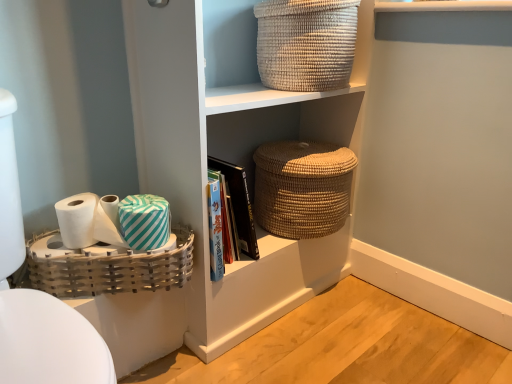
Question: Is natural woven basket at center, positioned as the 2th basket in bottom-to-top order, not inside white matte toilet paper at lower left, the 1th toilet paper positioned from the left?

Choices:
 (A) yes
 (B) no

Answer: (A)

Question: Can you confirm if natural woven basket at center, the 2th basket viewed from the top, is wider than white matte toilet paper at lower left, the 1th toilet paper positioned from the left?

Choices:
 (A) yes
 (B) no

Answer: (A)

Question: Is natural woven basket at center, the 2th basket viewed from the top, positioned with its back to white matte toilet paper at lower left, the 1th toilet paper positioned from the left?

Choices:
 (A) yes
 (B) no

Answer: (B)

Question: From a real-world perspective, is natural woven basket at center, positioned as the 2th basket in bottom-to-top order, beneath white matte toilet paper at lower left, placed as the 2th toilet paper when sorted from right to left?

Choices:
 (A) yes
 (B) no

Answer: (A)

Question: Does natural woven basket at center, positioned as the 2th basket in bottom-to-top order, have a lesser width compared to white matte toilet paper at lower left, the 1th toilet paper positioned from the left?

Choices:
 (A) no
 (B) yes

Answer: (A)

Question: Would you say woven bamboo basket at lower left, which is counted as the 3th basket, starting from the top, is to the left or to the right of teal striped fabric at lower left in the picture?

Choices:
 (A) right
 (B) left

Answer: (B)

Question: From the image's perspective, is woven bamboo basket at lower left, which is the 1th basket from bottom to top, located above or below teal striped fabric at lower left?

Choices:
 (A) below
 (B) above

Answer: (A)

Question: Considering the positions of woven bamboo basket at lower left, which is the 1th basket from bottom to top, and teal striped fabric at lower left in the image, is woven bamboo basket at lower left, which is the 1th basket from bottom to top, taller or shorter than teal striped fabric at lower left?

Choices:
 (A) tall
 (B) short

Answer: (A)

Question: From a real-world perspective, is woven bamboo basket at lower left, which is the 1th basket from bottom to top, physically located above or below teal striped fabric at lower left?

Choices:
 (A) above
 (B) below

Answer: (B)

Question: Considering the positions of point (101, 226) and point (100, 360), is point (101, 226) closer or farther from the camera than point (100, 360)?

Choices:
 (A) farther
 (B) closer

Answer: (A)

Question: Considering the relative positions of white matte toilet paper at lower left, the first toilet paper from the right, and white glossy toilet bowl at left in the image provided, is white matte toilet paper at lower left, the first toilet paper from the right, to the left or to the right of white glossy toilet bowl at left?

Choices:
 (A) left
 (B) right

Answer: (B)

Question: Is white matte toilet paper at lower left, the first toilet paper from the right, taller or shorter than white glossy toilet bowl at left?

Choices:
 (A) tall
 (B) short

Answer: (B)

Question: From a real-world perspective, is white matte toilet paper at lower left, the first toilet paper from the right, physically located above or below white glossy toilet bowl at left?

Choices:
 (A) above
 (B) below

Answer: (A)

Question: Would you say natural woven basket at upper center, the 1th basket positioned from the top, is to the left or to the right of white matte toilet paper at lower left, the first toilet paper from the right, in the picture?

Choices:
 (A) right
 (B) left

Answer: (A)

Question: In terms of size, does natural woven basket at upper center, the 3th basket in the bottom-to-top sequence, appear bigger or smaller than white matte toilet paper at lower left, the second toilet paper viewed from the left?

Choices:
 (A) big
 (B) small

Answer: (A)